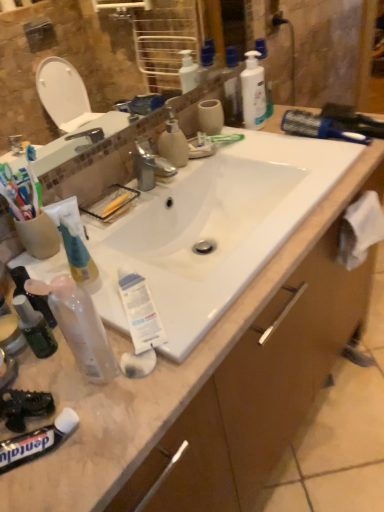
Identify the location of vacant space to the right of translucent plastic mouthwash at lower left. (156, 358).